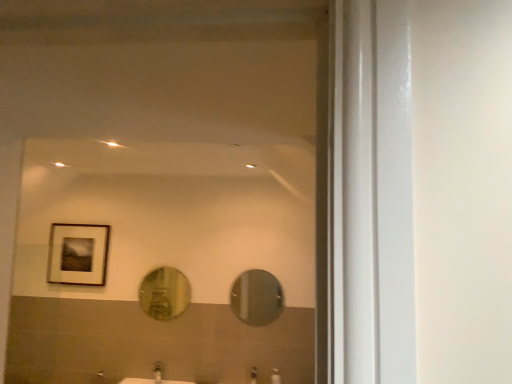
The image size is (512, 384). What do you see at coordinates (157, 372) in the screenshot? I see `matte silver faucet at lower center, the 1th faucet from the left` at bounding box center [157, 372].

This screenshot has height=384, width=512. In order to click on matte silver faucet at lower center, the second faucet when ordered from right to left in this screenshot , I will do `click(157, 372)`.

Considering the relative sizes of matte silver faucet at lower center, the 1th faucet in the right-to-left sequence, and wooden framed picture at upper left in the image provided, is matte silver faucet at lower center, the 1th faucet in the right-to-left sequence, taller than wooden framed picture at upper left?

No.

Can we say matte silver faucet at lower center, positioned as the 2th faucet in left-to-right order, lies outside wooden framed picture at upper left?

That's correct, matte silver faucet at lower center, positioned as the 2th faucet in left-to-right order, is outside of wooden framed picture at upper left.

Are matte silver faucet at lower center, positioned as the 2th faucet in left-to-right order, and wooden framed picture at upper left making contact?

matte silver faucet at lower center, positioned as the 2th faucet in left-to-right order, and wooden framed picture at upper left are not in contact.

Does matte silver faucet at lower center, positioned as the 2th faucet in left-to-right order, have a larger size compared to wooden framed picture at upper left?

No.

This screenshot has height=384, width=512. In the image, there is a shiny metallic mirror at center, arranged as the first mirror when viewed from the right. Identify the location of mirror above it (from the image's perspective). (164, 293).

From the image's perspective, is shiny metallic mirror at center, arranged as the first mirror when viewed from the right, positioned above or below gold textured mirror at center, positioned as the 1th mirror in left-to-right order?

Clearly, from the image's perspective, shiny metallic mirror at center, arranged as the first mirror when viewed from the right, is below gold textured mirror at center, positioned as the 1th mirror in left-to-right order.

From a real-world perspective, who is located lower, shiny metallic mirror at center, arranged as the first mirror when viewed from the right, or gold textured mirror at center, the 2th mirror in the right-to-left sequence?

In real-world perspective, shiny metallic mirror at center, arranged as the first mirror when viewed from the right, is lower.

From the picture: From the image's perspective, which object appears higher, shiny metallic mirror at center, the second mirror when ordered from left to right, or matte silver faucet at lower center, positioned as the 2th faucet in left-to-right order?

shiny metallic mirror at center, the second mirror when ordered from left to right, is shown above in the image.

Is shiny metallic mirror at center, arranged as the first mirror when viewed from the right, thinner than matte silver faucet at lower center, positioned as the 2th faucet in left-to-right order?

Correct, the width of shiny metallic mirror at center, arranged as the first mirror when viewed from the right, is less than that of matte silver faucet at lower center, positioned as the 2th faucet in left-to-right order.

Is shiny metallic mirror at center, the second mirror when ordered from left to right, oriented towards matte silver faucet at lower center, positioned as the 2th faucet in left-to-right order?

No, shiny metallic mirror at center, the second mirror when ordered from left to right, is not facing towards matte silver faucet at lower center, positioned as the 2th faucet in left-to-right order.

From the picture: From a real-world perspective, is shiny metallic mirror at center, arranged as the first mirror when viewed from the right, physically located above or below matte silver faucet at lower center, positioned as the 2th faucet in left-to-right order?

shiny metallic mirror at center, arranged as the first mirror when viewed from the right, is situated higher than matte silver faucet at lower center, positioned as the 2th faucet in left-to-right order, in the real world.

Consider the image. Is wooden framed picture at upper left turned away from shiny metallic mirror at center, the second mirror when ordered from left to right?

No, shiny metallic mirror at center, the second mirror when ordered from left to right, is not at the back of wooden framed picture at upper left.

Which object is closer to the camera taking this photo, wooden framed picture at upper left or shiny metallic mirror at center, arranged as the first mirror when viewed from the right?

shiny metallic mirror at center, arranged as the first mirror when viewed from the right, is in front.

Which of these two, wooden framed picture at upper left or shiny metallic mirror at center, arranged as the first mirror when viewed from the right, is bigger?

Bigger between the two is wooden framed picture at upper left.

Is wooden framed picture at upper left touching shiny metallic mirror at center, arranged as the first mirror when viewed from the right?

wooden framed picture at upper left and shiny metallic mirror at center, arranged as the first mirror when viewed from the right, are clearly separated.

Does gold textured mirror at center, positioned as the 1th mirror in left-to-right order, turn towards shiny metallic mirror at center, arranged as the first mirror when viewed from the right?

No, gold textured mirror at center, positioned as the 1th mirror in left-to-right order, does not turn towards shiny metallic mirror at center, arranged as the first mirror when viewed from the right.

Between gold textured mirror at center, the 2th mirror in the right-to-left sequence, and shiny metallic mirror at center, arranged as the first mirror when viewed from the right, which one appears on the right side from the viewer's perspective?

shiny metallic mirror at center, arranged as the first mirror when viewed from the right, is more to the right.

Find the location of a particular element. This screenshot has width=512, height=384. mirror above the shiny metallic mirror at center, the second mirror when ordered from left to right (from the image's perspective) is located at coordinates (164, 293).

From a real-world perspective, is gold textured mirror at center, positioned as the 1th mirror in left-to-right order, below shiny metallic mirror at center, arranged as the first mirror when viewed from the right?

No, from a real-world perspective, gold textured mirror at center, positioned as the 1th mirror in left-to-right order, is not below shiny metallic mirror at center, arranged as the first mirror when viewed from the right.

From the image's perspective, which one is positioned lower, matte silver faucet at lower center, the second faucet when ordered from right to left, or wooden framed picture at upper left?

matte silver faucet at lower center, the second faucet when ordered from right to left, from the image's perspective.

Is matte silver faucet at lower center, the 1th faucet from the left, facing towards wooden framed picture at upper left?

No, matte silver faucet at lower center, the 1th faucet from the left, is not aimed at wooden framed picture at upper left.

Is matte silver faucet at lower center, the second faucet when ordered from right to left, far from wooden framed picture at upper left?

Yes, matte silver faucet at lower center, the second faucet when ordered from right to left, is far from wooden framed picture at upper left.

From the image's perspective, is matte silver faucet at lower center, positioned as the 2th faucet in left-to-right order, beneath shiny metallic mirror at center, arranged as the first mirror when viewed from the right?

Indeed, from the image's perspective, matte silver faucet at lower center, positioned as the 2th faucet in left-to-right order, is shown beneath shiny metallic mirror at center, arranged as the first mirror when viewed from the right.

Would you say matte silver faucet at lower center, the 1th faucet in the right-to-left sequence, is outside shiny metallic mirror at center, the second mirror when ordered from left to right?

Absolutely, matte silver faucet at lower center, the 1th faucet in the right-to-left sequence, is external to shiny metallic mirror at center, the second mirror when ordered from left to right.

Which object is positioned more to the left, matte silver faucet at lower center, positioned as the 2th faucet in left-to-right order, or shiny metallic mirror at center, the second mirror when ordered from left to right?

matte silver faucet at lower center, positioned as the 2th faucet in left-to-right order.

Between matte silver faucet at lower center, the 1th faucet in the right-to-left sequence, and shiny metallic mirror at center, arranged as the first mirror when viewed from the right, which one has more height?

shiny metallic mirror at center, arranged as the first mirror when viewed from the right.

Locate an element on the screen. The height and width of the screenshot is (384, 512). the 2nd faucet to the right when counting from the wooden framed picture at upper left is located at coordinates click(253, 375).

This screenshot has width=512, height=384. Identify the location of mirror above the shiny metallic mirror at center, the second mirror when ordered from left to right (from the image's perspective). (164, 293).

Which object lies further to the anchor point gold textured mirror at center, the 2th mirror in the right-to-left sequence, shiny metallic mirror at center, the second mirror when ordered from left to right, or matte silver faucet at lower center, the 1th faucet in the right-to-left sequence?

matte silver faucet at lower center, the 1th faucet in the right-to-left sequence, is positioned further to the anchor gold textured mirror at center, the 2th mirror in the right-to-left sequence.

Considering their positions, is matte silver faucet at lower center, the second faucet when ordered from right to left, positioned further to matte silver faucet at lower center, positioned as the 2th faucet in left-to-right order, than gold textured mirror at center, positioned as the 1th mirror in left-to-right order?

gold textured mirror at center, positioned as the 1th mirror in left-to-right order, is positioned further to the anchor matte silver faucet at lower center, positioned as the 2th faucet in left-to-right order.

From the image, which object appears to be nearer to gold textured mirror at center, the 2th mirror in the right-to-left sequence, wooden framed picture at upper left or shiny metallic mirror at center, the second mirror when ordered from left to right?

shiny metallic mirror at center, the second mirror when ordered from left to right, is closer to gold textured mirror at center, the 2th mirror in the right-to-left sequence.

Estimate the real-world distances between objects in this image. Which object is closer to matte silver faucet at lower center, positioned as the 2th faucet in left-to-right order, gold textured mirror at center, positioned as the 1th mirror in left-to-right order, or wooden framed picture at upper left?

Among the two, gold textured mirror at center, positioned as the 1th mirror in left-to-right order, is located nearer to matte silver faucet at lower center, positioned as the 2th faucet in left-to-right order.

Based on their spatial positions, is matte silver faucet at lower center, positioned as the 2th faucet in left-to-right order, or matte silver faucet at lower center, the second faucet when ordered from right to left, closer to wooden framed picture at upper left?

matte silver faucet at lower center, the second faucet when ordered from right to left.

When comparing their distances from matte silver faucet at lower center, the 1th faucet in the right-to-left sequence, does shiny metallic mirror at center, arranged as the first mirror when viewed from the right, or gold textured mirror at center, positioned as the 1th mirror in left-to-right order, seem further?

gold textured mirror at center, positioned as the 1th mirror in left-to-right order, is further to matte silver faucet at lower center, the 1th faucet in the right-to-left sequence.

From the image, which object appears to be nearer to wooden framed picture at upper left, shiny metallic mirror at center, the second mirror when ordered from left to right, or matte silver faucet at lower center, positioned as the 2th faucet in left-to-right order?

shiny metallic mirror at center, the second mirror when ordered from left to right.

From the image, which object appears to be farther from wooden framed picture at upper left, matte silver faucet at lower center, the second faucet when ordered from right to left, or matte silver faucet at lower center, positioned as the 2th faucet in left-to-right order?

matte silver faucet at lower center, positioned as the 2th faucet in left-to-right order, is further to wooden framed picture at upper left.

Where is `mirror between wooden framed picture at upper left and matte silver faucet at lower center, positioned as the 2th faucet in left-to-right order, from left to right`? The width and height of the screenshot is (512, 384). mirror between wooden framed picture at upper left and matte silver faucet at lower center, positioned as the 2th faucet in left-to-right order, from left to right is located at coordinates (164, 293).

Locate an element on the screen. This screenshot has width=512, height=384. mirror between matte silver faucet at lower center, the second faucet when ordered from right to left, and matte silver faucet at lower center, positioned as the 2th faucet in left-to-right order is located at coordinates (164, 293).

This screenshot has width=512, height=384. Find the location of `mirror located between wooden framed picture at upper left and shiny metallic mirror at center, the second mirror when ordered from left to right, in the left-right direction`. mirror located between wooden framed picture at upper left and shiny metallic mirror at center, the second mirror when ordered from left to right, in the left-right direction is located at coordinates (164, 293).

Where is `faucet situated between wooden framed picture at upper left and matte silver faucet at lower center, the 1th faucet in the right-to-left sequence, from left to right`? faucet situated between wooden framed picture at upper left and matte silver faucet at lower center, the 1th faucet in the right-to-left sequence, from left to right is located at coordinates (157, 372).